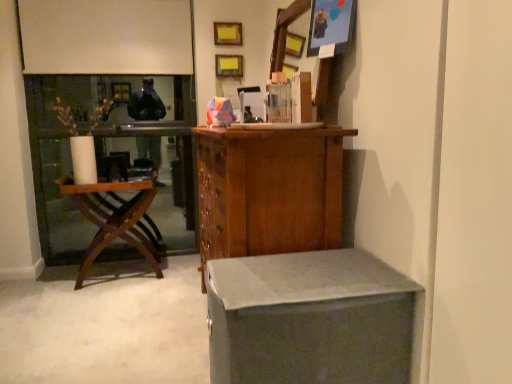
Question: Looking at their shapes, would you say wooden picture frame at upper center, which is the 3th picture frame in front-to-back order, is wider or thinner than matte wooden picture frame at upper right, the third picture frame when ordered from back to front?

Choices:
 (A) thin
 (B) wide

Answer: (A)

Question: Is wooden picture frame at upper center, which is the 3th picture frame in front-to-back order, in front of or behind matte wooden picture frame at upper right, the third picture frame when ordered from left to right, in the image?

Choices:
 (A) behind
 (B) front

Answer: (A)

Question: Which of these objects is positioned farthest from the matte yellow picture frame at upper center, the third picture frame in the right-to-left sequence?

Choices:
 (A) matte gray desk at lower right
 (B) matte wooden picture frame at upper right, the first picture frame in the bottom-to-top sequence
 (C) woodenchair at left
 (D) wooden cabinet at center
 (E) wooden picture frame at upper center, positioned as the second picture frame in bottom-to-top order

Answer: (A)

Question: Estimate the real-world distances between objects in this image. Which object is farther from the woodenchair at left?

Choices:
 (A) matte yellow picture frame at upper center, which appears as the first picture frame when viewed from the top
 (B) matte gray desk at lower right
 (C) wooden cabinet at center
 (D) wooden picture frame at upper center, acting as the 2th picture frame starting from the top
 (E) matte wooden picture frame at upper right, the third picture frame when ordered from left to right

Answer: (E)